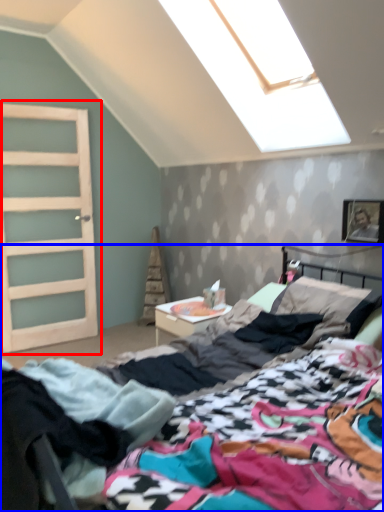
Question: Among these objects, which one is nearest to the camera, door (highlighted by a red box) or bed (highlighted by a blue box)?

Choices:
 (A) door
 (B) bed

Answer: (B)